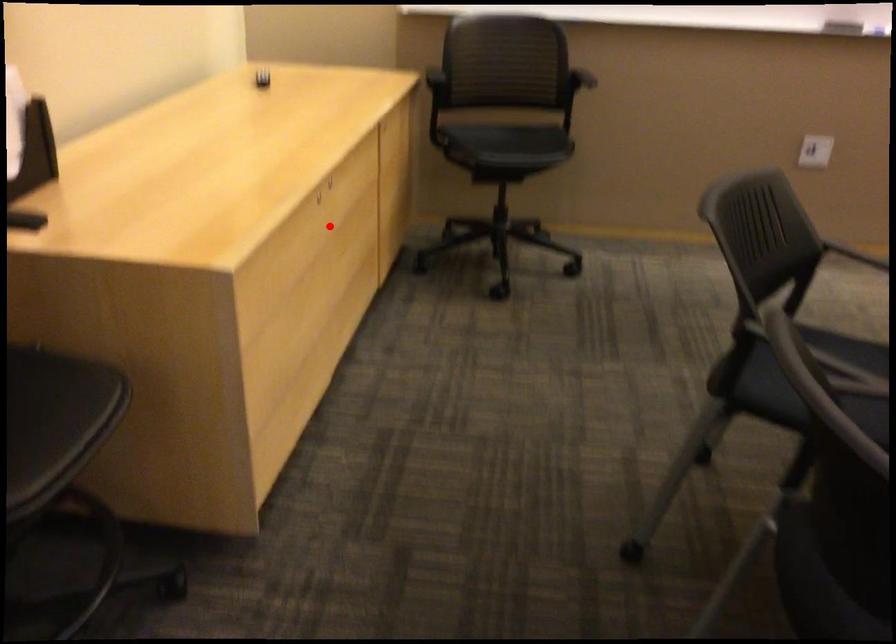
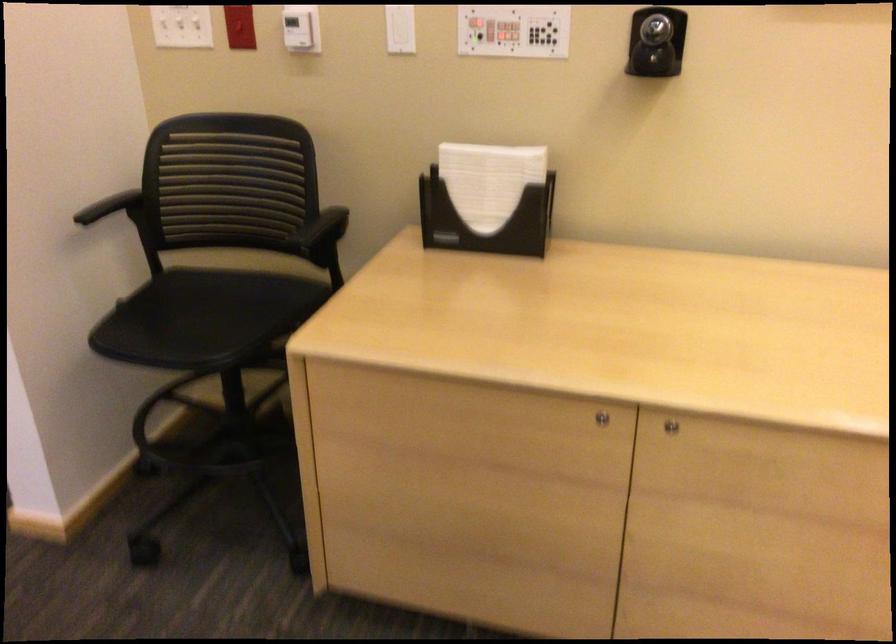
Where in the second image is the point corresponding to the highlighted location from the first image?

(600, 418)